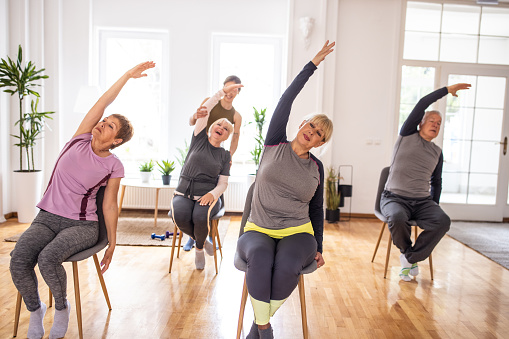
Identify the location of person stretching in chair. The height and width of the screenshot is (339, 509). (296, 172), (210, 151), (78, 176), (418, 163).